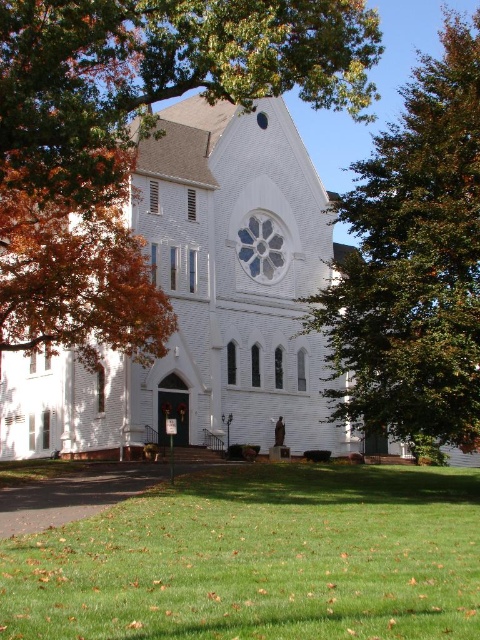
Consider the image. You are standing at the entrance of the white church and want to walk towards the green leafy tree at upper right. Which direction should you walk to avoid stepping on the green grass at lower center?

To avoid stepping on the green grass at lower center, you should walk towards the green leafy tree at upper right while staying on the path that is not covered by the green grass at lower center. Since the green grass at lower center has a lesser width than the green leafy tree at upper right, you can navigate around it by moving along the side where the grass is narrower.

Looking at this image, you are standing at the entrance of the white church and want to place a small flower pot on the green grass at lower center. According to the coordinates provided, where exactly should you place it?

The green grass at lower center is located at point (259, 560), so you should place the flower pot there.

You are a photographer planning to capture the white brick church at center and the green grass at lower center in a single shot. Which of the two elements will occupy more of the frame?

The white brick church at center occupies more space than the green grass at lower center, so it will take up more of the frame.